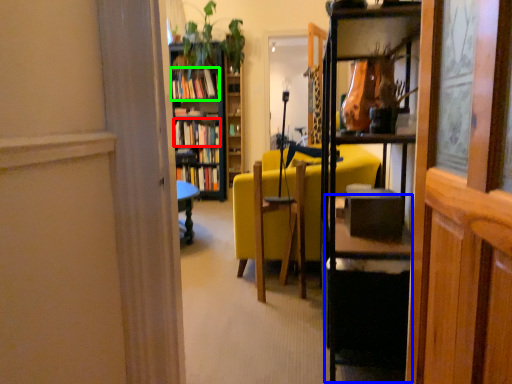
Question: Considering the real-world distances, which object is closest to book (highlighted by a red box)? table (highlighted by a blue box) or book (highlighted by a green box).

Choices:
 (A) table
 (B) book

Answer: (B)